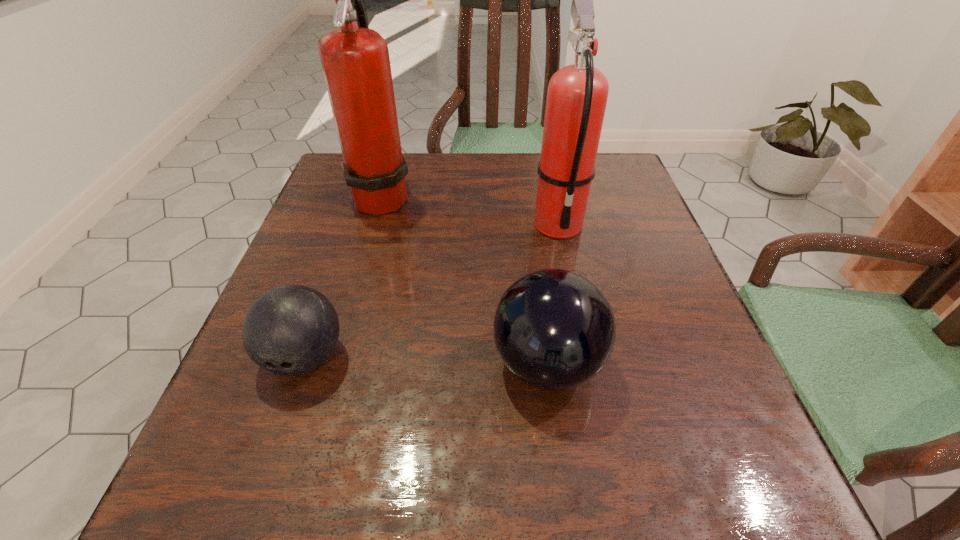
The height and width of the screenshot is (540, 960). I want to click on the left fire extinguisher, so click(355, 60).

The height and width of the screenshot is (540, 960). Find the location of `the right fire extinguisher`. the right fire extinguisher is located at coordinates (577, 94).

Image resolution: width=960 pixels, height=540 pixels. Identify the location of the second shortest object. (555, 330).

You are a GUI agent. You are given a task and a screenshot of the screen. Output one action in this format:
    pyautogui.click(x=<x>, y=<y>)
    Task: Click on the right bowling ball
    The height and width of the screenshot is (540, 960).
    Given the screenshot: What is the action you would take?
    pyautogui.click(x=555, y=330)

You are a GUI agent. You are given a task and a screenshot of the screen. Output one action in this format:
    pyautogui.click(x=<x>, y=<y>)
    Task: Click on the left bowling ball
    The width and height of the screenshot is (960, 540).
    Given the screenshot: What is the action you would take?
    pyautogui.click(x=290, y=330)

The height and width of the screenshot is (540, 960). Find the location of `the shorter bowling ball`. the shorter bowling ball is located at coordinates (290, 330).

Locate an element on the screen. Image resolution: width=960 pixels, height=540 pixels. free space located at the nozzle of the left fire extinguisher is located at coordinates (501, 195).

I want to click on vacant space located on the hose direction of the right fire extinguisher, so click(574, 302).

You are a GUI agent. You are given a task and a screenshot of the screen. Output one action in this format:
    pyautogui.click(x=<x>, y=<y>)
    Task: Click on the vacant space located on the side of the second shortest object with the finger holes
    The width and height of the screenshot is (960, 540).
    Given the screenshot: What is the action you would take?
    pyautogui.click(x=411, y=364)

This screenshot has height=540, width=960. I want to click on free location located on the side of the second shortest object with the finger holes, so click(x=261, y=364).